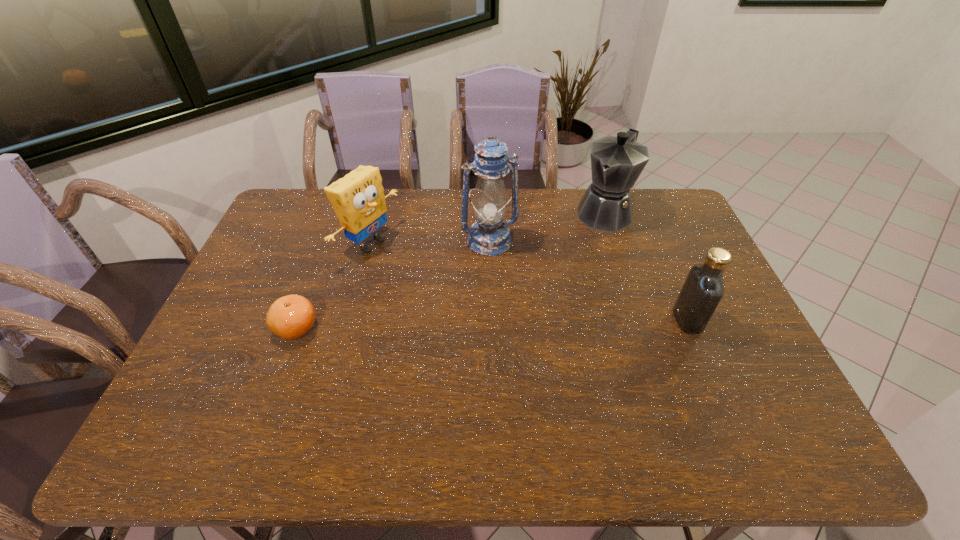
I want to click on free space located on the face of the sponge, so click(x=420, y=274).

Identify the location of vacant space located on the face of the sponge. This screenshot has height=540, width=960. (470, 299).

You are a GUI agent. You are given a task and a screenshot of the screen. Output one action in this format:
    pyautogui.click(x=<x>, y=<y>)
    Task: Click on the free space located on the front-facing side of the third object from left to right
    The height and width of the screenshot is (540, 960).
    Given the screenshot: What is the action you would take?
    pyautogui.click(x=544, y=345)

The width and height of the screenshot is (960, 540). What are the coordinates of `vacant space located 0.100m on the front-facing side of the third object from left to right` in the screenshot? It's located at (509, 276).

Identify the location of free space located 0.120m on the front-facing side of the third object from left to right. (512, 281).

Where is `free region located at the spout of the second tallest object`? free region located at the spout of the second tallest object is located at coordinates (556, 283).

Locate an element on the screen. vacant point located 0.290m at the spout of the second tallest object is located at coordinates (558, 281).

Find the location of a particular element. vacant space located at the spout of the second tallest object is located at coordinates (570, 264).

I want to click on sponge at the far edge, so click(x=358, y=199).

The width and height of the screenshot is (960, 540). Find the location of `lantern that is at the far edge`. lantern that is at the far edge is located at coordinates (489, 236).